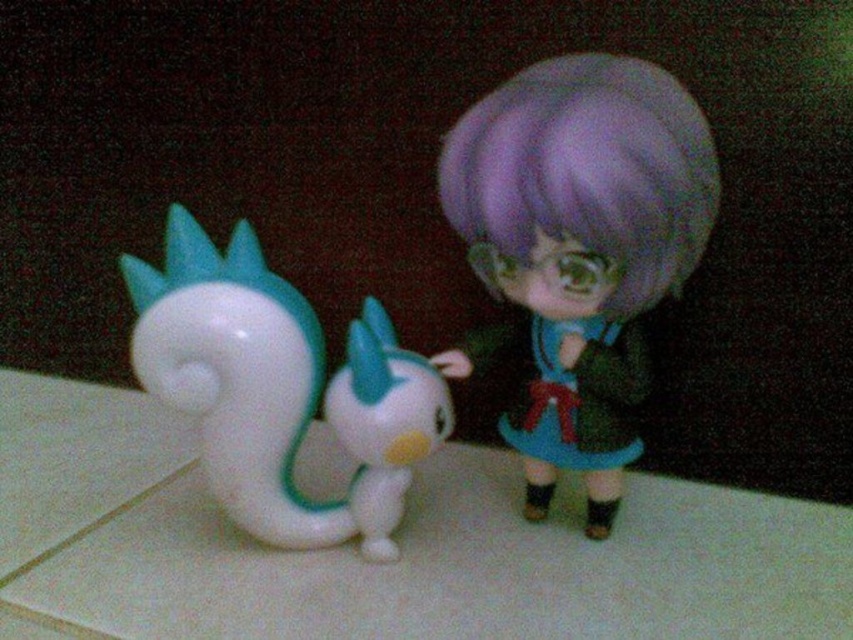
Question: Is purple matte doll at center above white glossy toy at left?

Choices:
 (A) no
 (B) yes

Answer: (B)

Question: Which point is closer to the camera taking this photo?

Choices:
 (A) (206, 284)
 (B) (357, 436)

Answer: (A)

Question: Which of these objects is positioned closest to the white glossy toy at left?

Choices:
 (A) purple matte doll at center
 (B) white glossy bird at center

Answer: (B)

Question: Which point is farther to the camera?

Choices:
 (A) (577, 429)
 (B) (390, 531)
 (C) (225, 317)

Answer: (B)

Question: From the image, what is the correct spatial relationship of white glossy toy at left in relation to white glossy bird at center?

Choices:
 (A) right
 (B) left

Answer: (B)

Question: Is the position of white glossy toy at left more distant than that of white glossy bird at center?

Choices:
 (A) no
 (B) yes

Answer: (A)